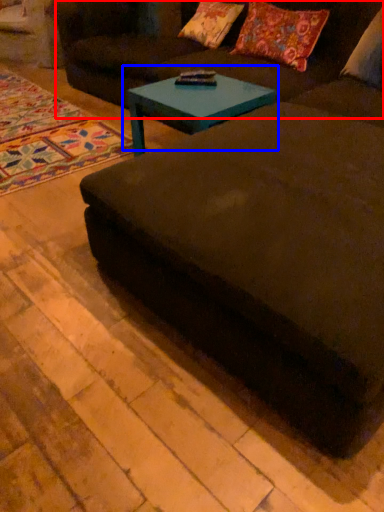
Question: Which object is further to the camera taking this photo, couch (highlighted by a red box) or coffee table (highlighted by a blue box)?

Choices:
 (A) couch
 (B) coffee table

Answer: (B)